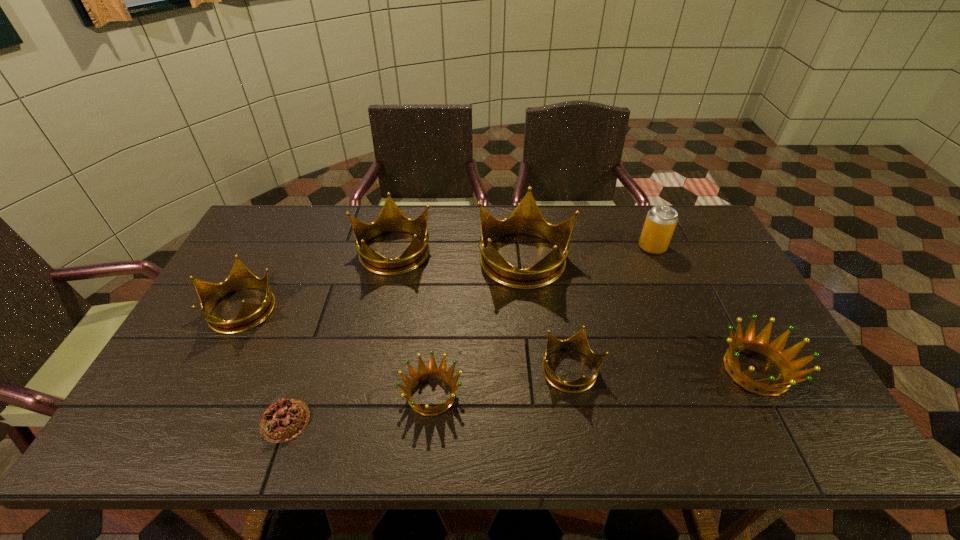
The width and height of the screenshot is (960, 540). I want to click on empty space between the third biggest gold crown and the smallest gold crown, so 406,340.

The height and width of the screenshot is (540, 960). What are the coordinates of `free space between the tallest crown and the rightmost crown` in the screenshot? It's located at (640, 314).

You are a GUI agent. You are given a task and a screenshot of the screen. Output one action in this format:
    pyautogui.click(x=<x>, y=<y>)
    Task: Click on the free spot between the seventh tallest object and the nearest gold crown
    This screenshot has height=540, width=960.
    Given the screenshot: What is the action you would take?
    pyautogui.click(x=501, y=383)

The image size is (960, 540). In order to click on empty location between the second biggest gold crown and the right golden crown in this screenshot , I will do `click(574, 310)`.

You are a GUI agent. You are given a task and a screenshot of the screen. Output one action in this format:
    pyautogui.click(x=<x>, y=<y>)
    Task: Click on the empty location between the leftmost crown and the tallest object
    
    Given the screenshot: What is the action you would take?
    pyautogui.click(x=383, y=283)

In order to click on free space that is in between the smallest gold crown and the tallest crown in this screenshot , I will do `click(548, 314)`.

At what (x,y) coordinates should I click in order to perform the action: click on empty space between the pop (soda) and the shortest crown. Please return your answer as a coordinate pair (x, y). This screenshot has width=960, height=540. Looking at the image, I should click on (542, 321).

At what (x,y) coordinates should I click in order to perform the action: click on unoccupied area between the third smallest gold crown and the nearest gold crown. Please return your answer as a coordinate pair (x, y). This screenshot has width=960, height=540. Looking at the image, I should click on (482, 310).

This screenshot has width=960, height=540. I want to click on vacant space in between the chocolate cake and the tallest crown, so click(x=405, y=339).

Select which object is the seventh closest to the seventh tallest object. Please provide its 2D coordinates. Your answer should be formatted as a tuple, i.e. [(x, y)], where the tuple contains the x and y coordinates of a point satisfying the conditions above.

[(661, 220)]